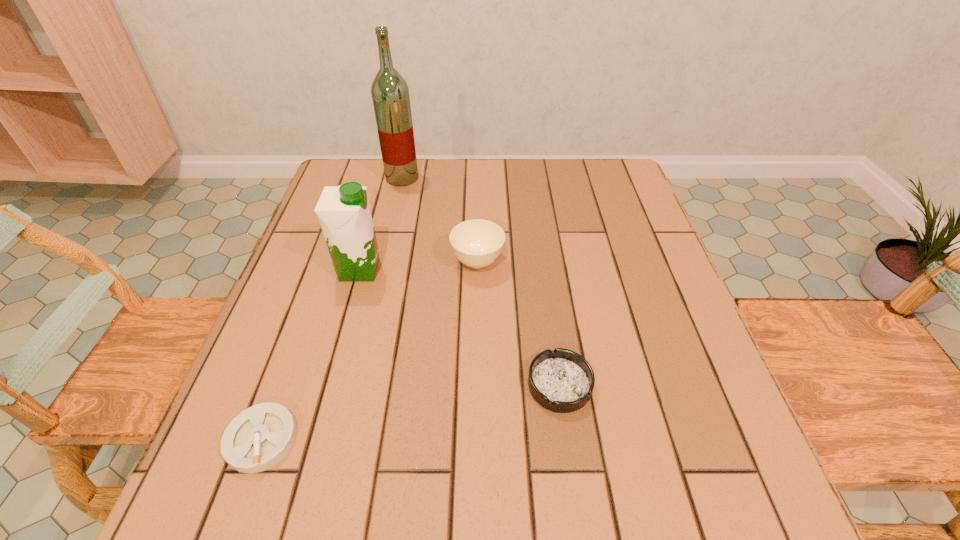
The height and width of the screenshot is (540, 960). I want to click on free spot that satisfies the following two spatial constraints: 1. on the front-facing side of the soya milk; 2. on the front side of the left ashtray, so click(312, 439).